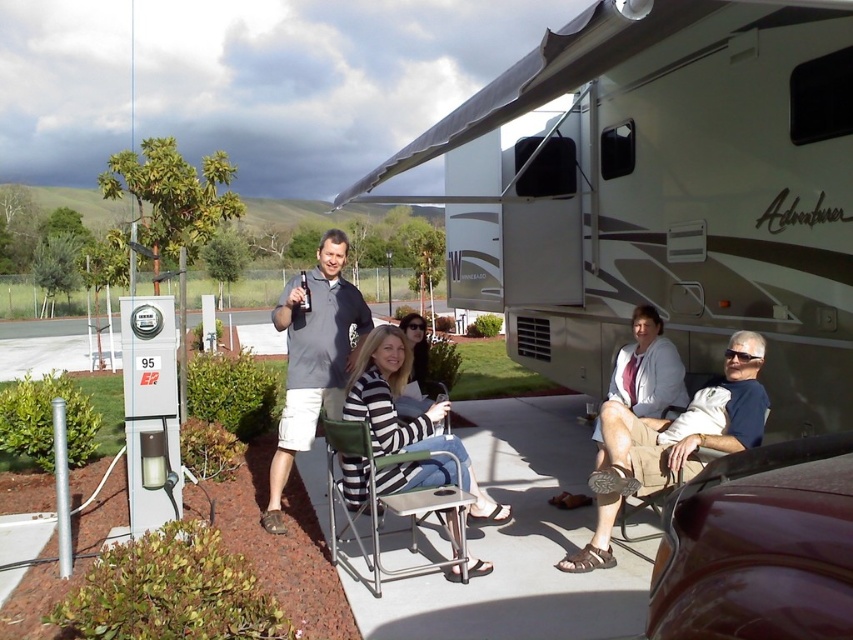
You are standing at the camera position and want to hand the striped fabric jacket at center to someone. Can you reach it without moving from where you are?

The striped fabric jacket at center and camera are 3.99 meters apart from each other, so you cannot reach it without moving from where you are.